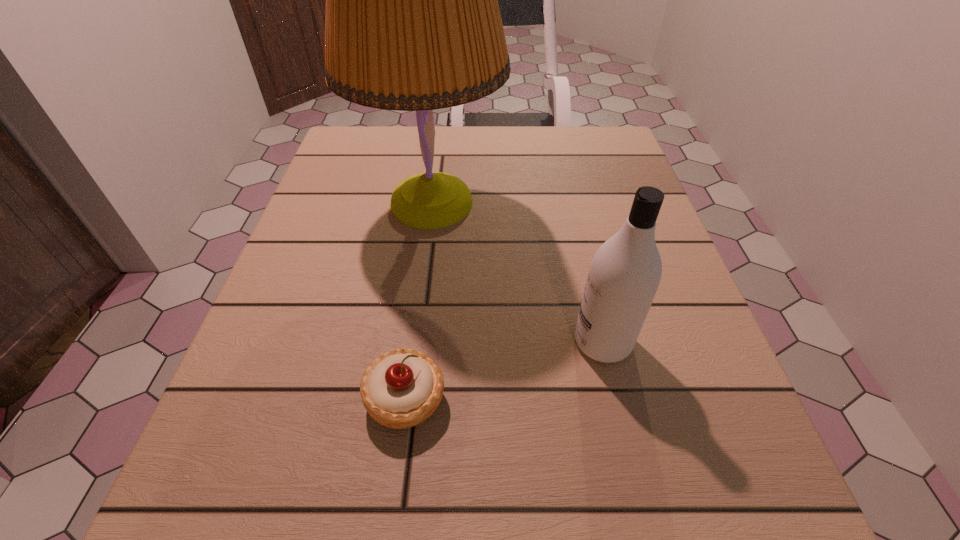
Image resolution: width=960 pixels, height=540 pixels. What are the coordinates of `the tallest object` in the screenshot? It's located at (412, 23).

Find the location of `the farthest object`. the farthest object is located at coordinates (412, 23).

Where is `shampoo`? The height and width of the screenshot is (540, 960). shampoo is located at coordinates click(x=625, y=272).

Where is `the rightmost object`? The width and height of the screenshot is (960, 540). the rightmost object is located at coordinates (625, 272).

Image resolution: width=960 pixels, height=540 pixels. Identify the location of the shortest object. (401, 388).

Locate an element on the screen. free point located 0.140m on the side of the farthest object near the pull switch is located at coordinates (568, 204).

Locate an element on the screen. vacant space located 0.280m on the front-facing side of the second tallest object is located at coordinates (399, 342).

Locate an element on the screen. This screenshot has width=960, height=540. free region located on the front-facing side of the second tallest object is located at coordinates (380, 342).

Where is `free space located on the front-facing side of the second tallest object`? The height and width of the screenshot is (540, 960). free space located on the front-facing side of the second tallest object is located at coordinates (399, 342).

The width and height of the screenshot is (960, 540). I want to click on free space located on the right of the pastry, so click(x=618, y=398).